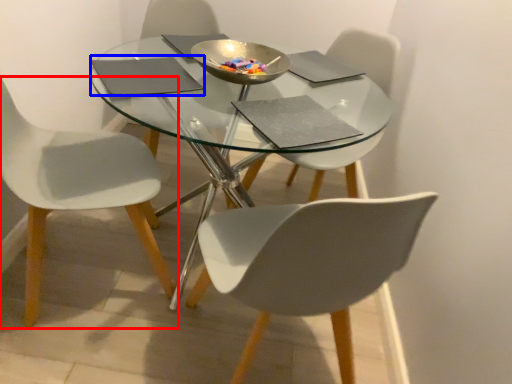
Question: Which of the following is the farthest to the observer, chair (highlighted by a red box) or pad (highlighted by a blue box)?

Choices:
 (A) chair
 (B) pad

Answer: (B)